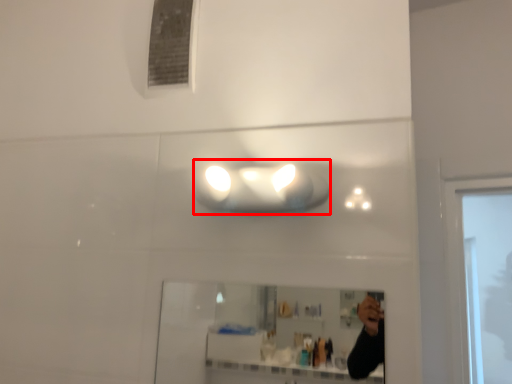
Question: From the image, what is the correct spatial relationship of light fixture (annotated by the red box) in relation to mirror?

Choices:
 (A) left
 (B) right

Answer: (A)